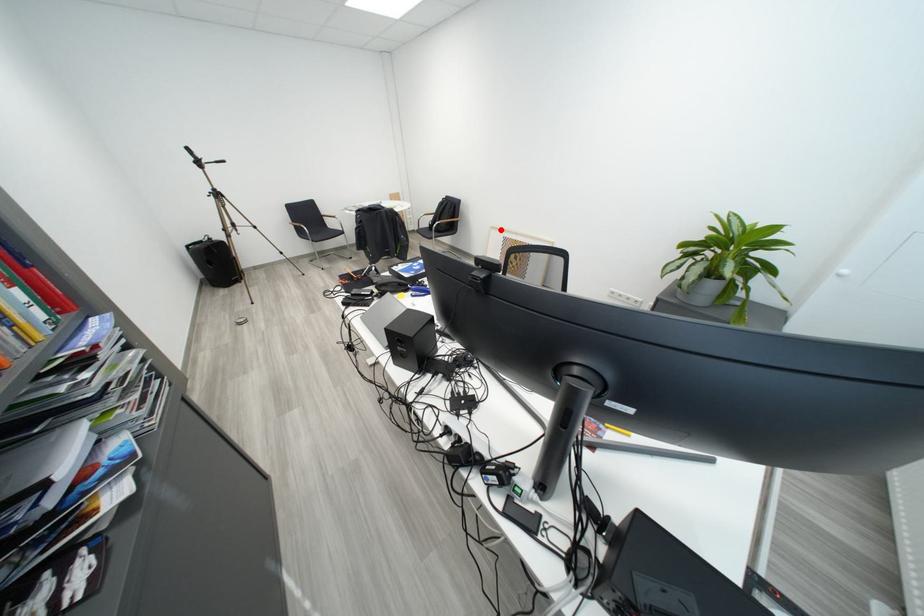
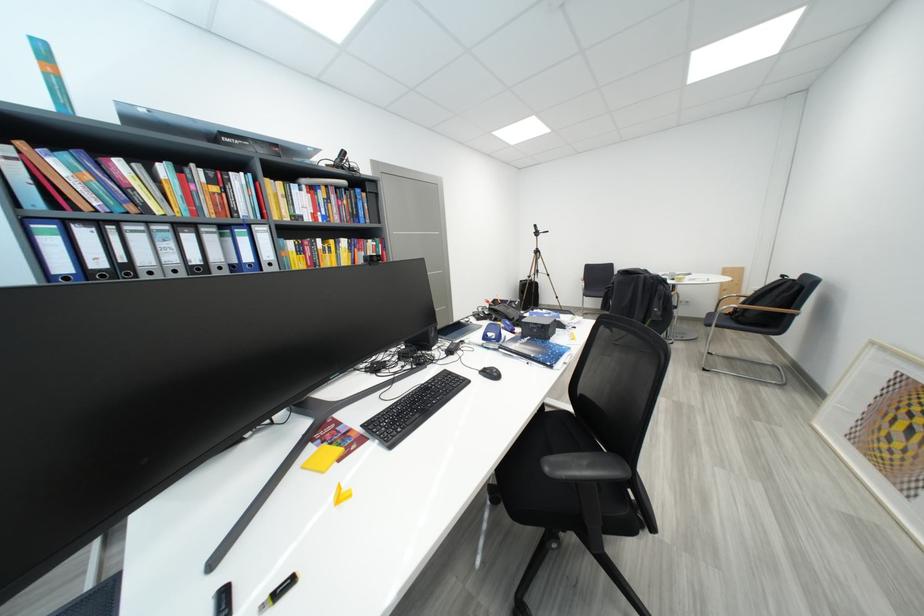
Question: A red point is marked in image1. In image2, is the corresponding 3D point closer to the camera or farther? Reply with the corresponding letter.

Choices:
 (A) The corresponding 3D point is closer.
 (B) The corresponding 3D point is farther.

Answer: (B)